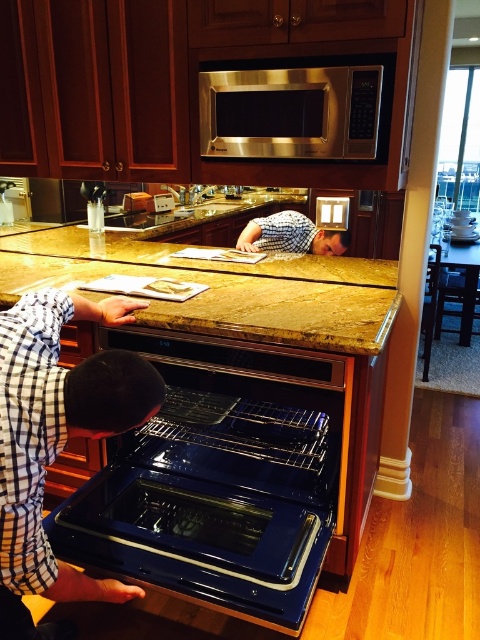
Question: Observing the image, what is the correct spatial positioning of shiny black oven at center in reference to shiny blue oven at lower center?

Choices:
 (A) right
 (B) left

Answer: (A)

Question: Estimate the real-world distances between objects in this image. Which object is farther from the shiny blue oven at lower center?

Choices:
 (A) shiny black oven at center
 (B) checkered fabric shirt at center

Answer: (B)

Question: Is shiny blue oven at lower center to the right of checkered fabric shirt at center from the viewer's perspective?

Choices:
 (A) yes
 (B) no

Answer: (B)

Question: Which point is farther to the camera?

Choices:
 (A) shiny black oven at center
 (B) brown polished granite counter at center

Answer: (B)

Question: Which of the following is the farthest from the observer?

Choices:
 (A) shiny black oven at center
 (B) satin stainless steel microwave at upper center

Answer: (B)

Question: Does brown polished granite counter at center appear on the right side of checkered fabric shirt at center?

Choices:
 (A) no
 (B) yes

Answer: (A)